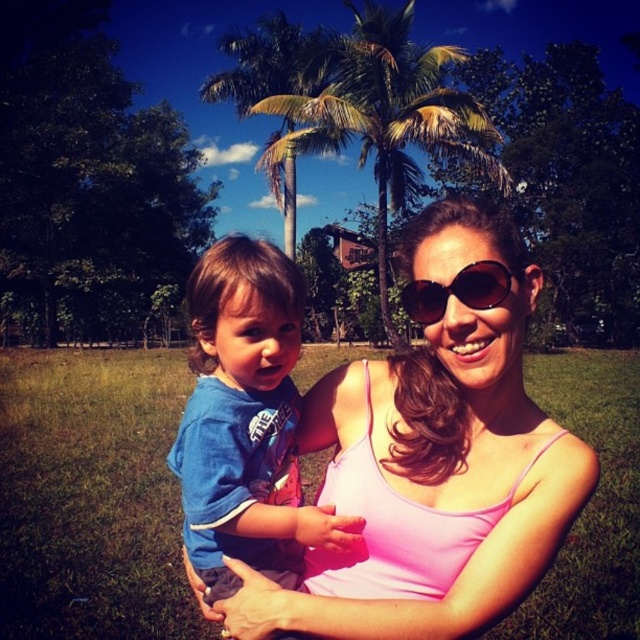
Consider the image. You are a photographer trying to capture the child in the blue cotton shirt at center. You notice a point at coordinates [246,422]. Is this point located on the child or the mother?

The point at coordinates [246,422] is located on the blue cotton shirt at center, which belongs to the child, so the point is on the child.

In the scene shown: You are a photographer trying to capture a closeup of the blue cotton shirt at center. Given that your camera has a focal length of 50mm and you are currently 2 meters away from the shirt, can you estimate whether you need to move closer or farther away to achieve focus? Please consider the shirt is at coordinates point 0.661, 0.386 in the image frame.

The position of blue cotton shirt at center is at point (246, 422), which is within the focus range of a 50mm lens at 2 meters distance. Therefore, you do not need to adjust your distance further.